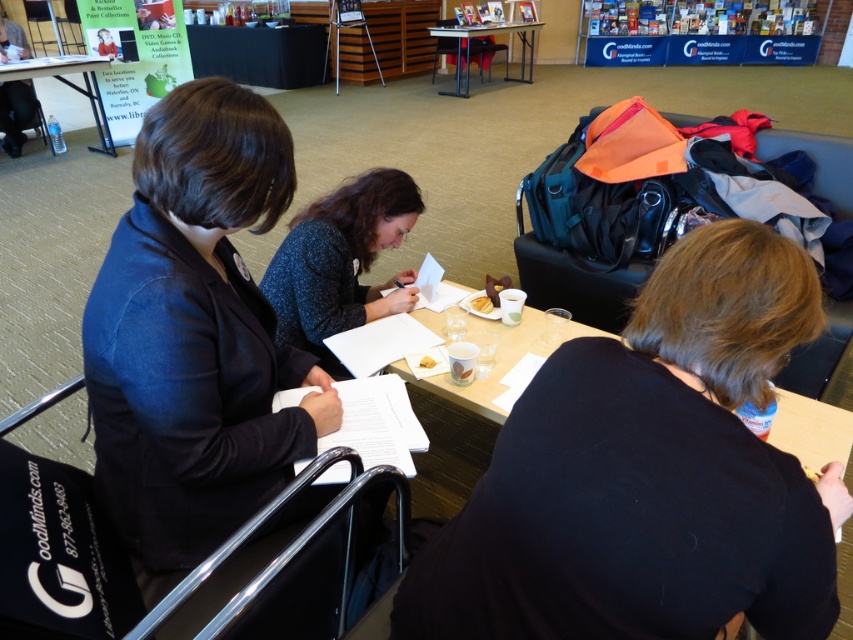
Does sparkly blue sweater at center appear on the left side of white paper plate at center?

Yes, sparkly blue sweater at center is to the left of white paper plate at center.

Who is more distant from viewer, (317, 273) or (426, 355)?

Point (317, 273)

Is point (280, 340) behind point (436, 362)?

That is True.

You are a GUI agent. You are given a task and a screenshot of the screen. Output one action in this format:
    pyautogui.click(x=<x>, y=<y>)
    Task: Click on the sparkly blue sweater at center
    Image resolution: width=853 pixels, height=640 pixels.
    Given the screenshot: What is the action you would take?
    pyautogui.click(x=341, y=262)

Does sparkly blue sweater at center have a greater width compared to metallic silver table at upper center?

Incorrect, sparkly blue sweater at center's width does not surpass metallic silver table at upper center's.

Where is `sparkly blue sweater at center`? This screenshot has width=853, height=640. sparkly blue sweater at center is located at coordinates (341, 262).

Locate an element on the screen. sparkly blue sweater at center is located at coordinates (341, 262).

Between point (492, 32) and point (485, 298), which one is positioned in front?

Point (485, 298) is in front.

Is metallic silver table at upper center positioned in front of white paper napkin at center?

No, metallic silver table at upper center is behind white paper napkin at center.

This screenshot has width=853, height=640. Find the location of `metallic silver table at upper center`. metallic silver table at upper center is located at coordinates (473, 52).